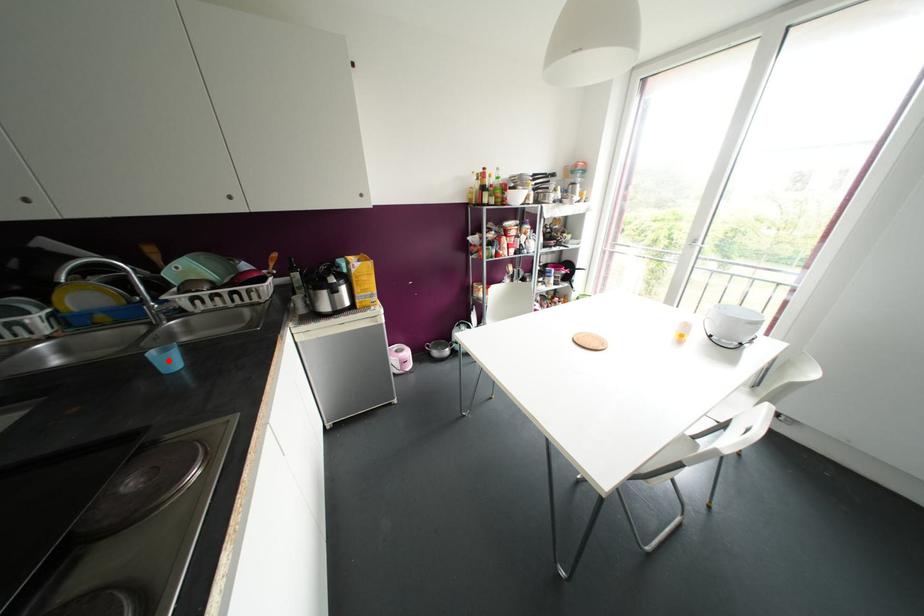
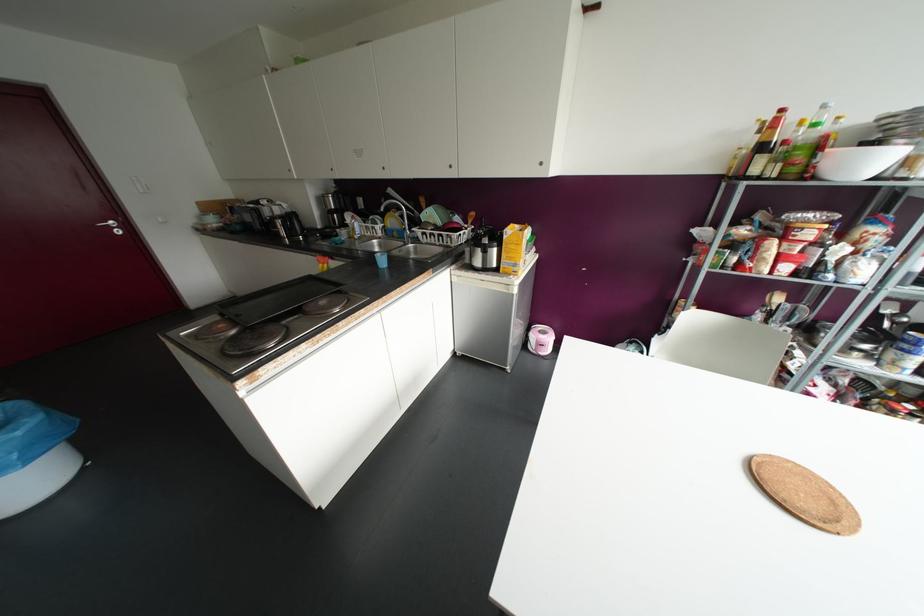
Question: I am providing you with two images of the same scene from different viewpoints. In image1, a red point is highlighted. Considering the same 3D point in image2, which of the following is correct?

Choices:
 (A) It is closer
 (B) It is farther

Answer: (A)